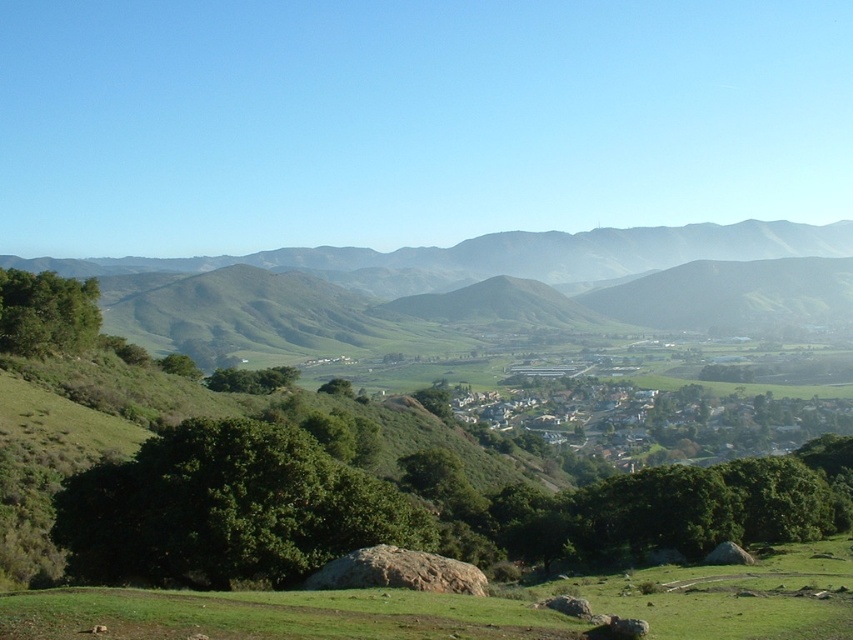
Who is more forward, (293, 269) or (814, 579)?

Point (814, 579) is in front.

The height and width of the screenshot is (640, 853). Find the location of `green grassy hillside at center`. green grassy hillside at center is located at coordinates (425, 278).

Find the location of `green grassy hillside at center`. green grassy hillside at center is located at coordinates (425, 278).